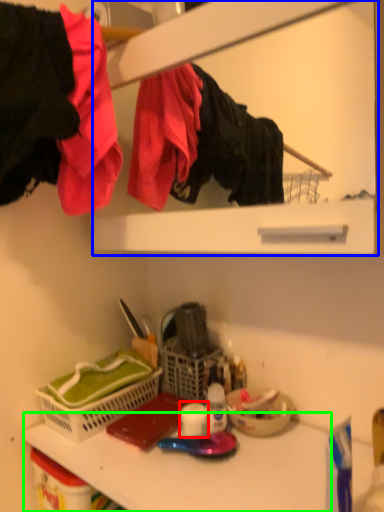
Question: Estimate the real-world distances between objects in this image. Which object is farther from toilet paper (highlighted by a red box), medicine cabinet (highlighted by a blue box) or counter top (highlighted by a green box)?

Choices:
 (A) medicine cabinet
 (B) counter top

Answer: (A)